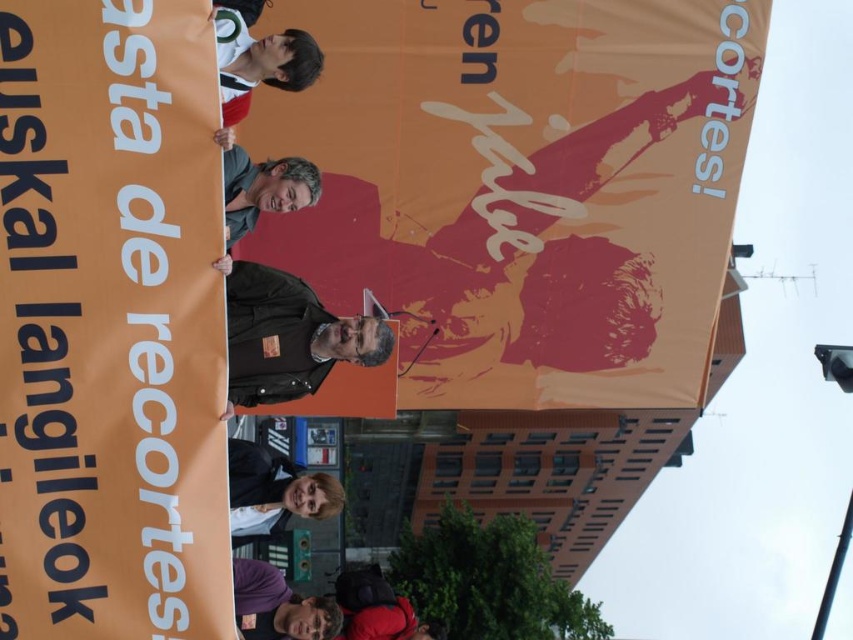
You are a photographer at the protest. You want to take a photo of the large orange banner held by the group but need to ensure the point at coordinates point [289,337] is visible in the frame. Is the point on the banner?

The point [289,337] is on black leather jacket at center, not on the banner, so it will not be visible on the banner in the photo.

You are a photographer trying to capture a closeup of the purple fabric at lower center and the matte black jacket at center. Which object should you zoom in on to ensure both are in frame without moving the camera?

The purple fabric at lower center might be wider than matte black jacket at center, so you should zoom in on the purple fabric at lower center to ensure both are in frame without moving the camera.